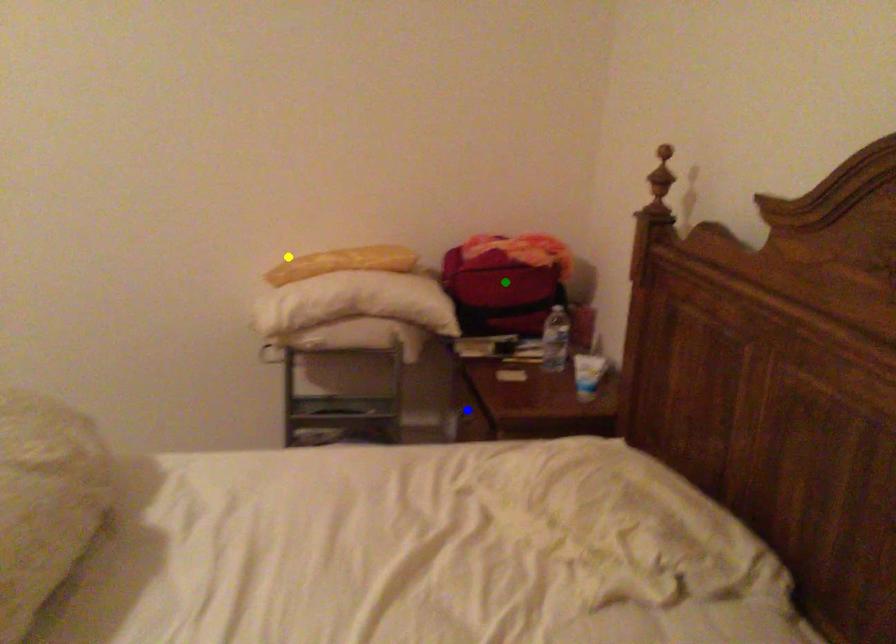
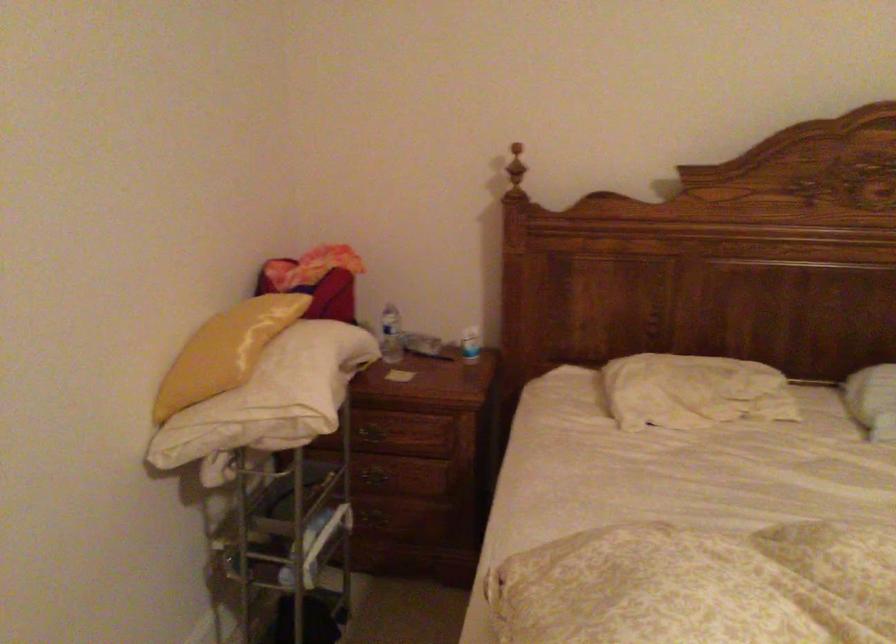
I am providing you with two images of the same scene from different viewpoints. Three points are marked in image1. Which point corresponds to a part or object that is occluded in image2?In image1, three points are marked. Which of them correspond to a part or object that is occluded in image2?Among the three points shown in image1, which one corresponds to a part or object that is no longer visible due to occlusion in image2?

green point